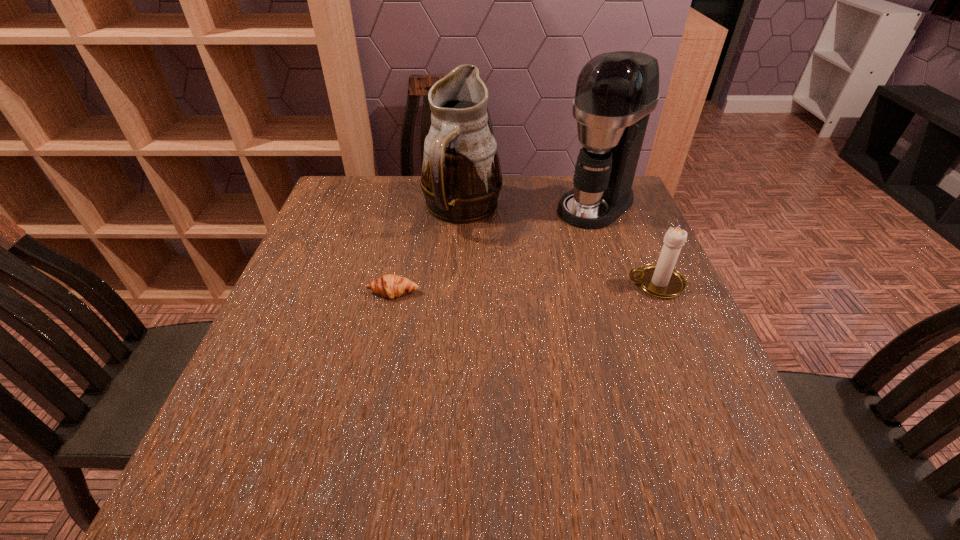
In the image, there is a desktop. What are the coordinates of `vacant space at the near edge` in the screenshot? It's located at (495, 425).

At what (x,y) coordinates should I click in order to perform the action: click on vacant region at the left edge. Please return your answer as a coordinate pair (x, y). The image size is (960, 540). Looking at the image, I should click on (272, 349).

Locate an element on the screen. The width and height of the screenshot is (960, 540). free space at the right edge of the desktop is located at coordinates (654, 356).

You are a GUI agent. You are given a task and a screenshot of the screen. Output one action in this format:
    pyautogui.click(x=<x>, y=<y>)
    Task: Click on the vacant space at the far left corner of the desktop
    This screenshot has width=960, height=540.
    Given the screenshot: What is the action you would take?
    pyautogui.click(x=315, y=218)

Identify the location of vacant space at the near left corner of the desktop. (290, 430).

Image resolution: width=960 pixels, height=540 pixels. In the image, there is a desktop. Find the location of `free space at the near right corner`. free space at the near right corner is located at coordinates (717, 424).

Identify the location of free space between the coffee maker and the pitcher. (529, 207).

You are a GUI agent. You are given a task and a screenshot of the screen. Output one action in this format:
    pyautogui.click(x=<x>, y=<y>)
    Task: Click on the vacant space that is in between the candle holder and the shortest object
    The width and height of the screenshot is (960, 540).
    Given the screenshot: What is the action you would take?
    pyautogui.click(x=524, y=288)

The image size is (960, 540). Find the location of `vacant point located between the second tallest object and the pastry`. vacant point located between the second tallest object and the pastry is located at coordinates (427, 251).

Find the location of `vacant space that's between the pastry and the coffee maker`. vacant space that's between the pastry and the coffee maker is located at coordinates click(x=494, y=249).